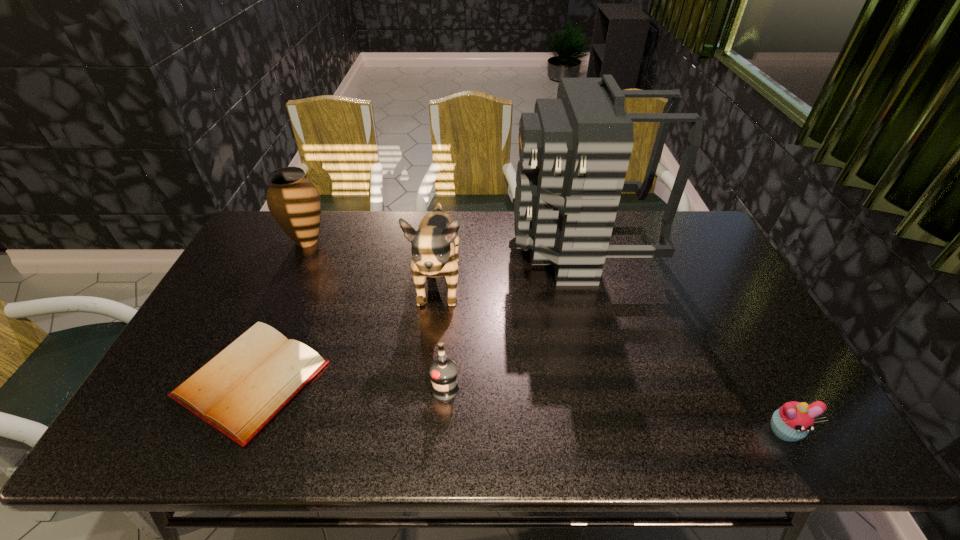
Identify the location of the tallest object. (574, 151).

The width and height of the screenshot is (960, 540). In order to click on the second object from right to left in this screenshot , I will do `click(574, 151)`.

Where is `puppy`? puppy is located at coordinates (434, 249).

Locate an element on the screen. urn is located at coordinates (293, 200).

At what (x,y) coordinates should I click in order to perform the action: click on the fourth tallest object. Please return your answer as a coordinate pair (x, y). Image resolution: width=960 pixels, height=540 pixels. Looking at the image, I should click on (443, 371).

In order to click on the second shortest object in this screenshot , I will do `click(792, 421)`.

You are a GUI agent. You are given a task and a screenshot of the screen. Output one action in this format:
    pyautogui.click(x=<x>, y=<y>)
    Task: Click on the rightmost object
    Image resolution: width=960 pixels, height=540 pixels.
    Given the screenshot: What is the action you would take?
    pyautogui.click(x=792, y=421)

In order to click on the shortest object in this screenshot , I will do `click(239, 391)`.

Image resolution: width=960 pixels, height=540 pixels. Find the location of `free space located 0.170m on the front compartment of the backpack`. free space located 0.170m on the front compartment of the backpack is located at coordinates (462, 247).

The width and height of the screenshot is (960, 540). Identify the location of vacant area located 0.320m on the front compartment of the backpack. (418, 247).